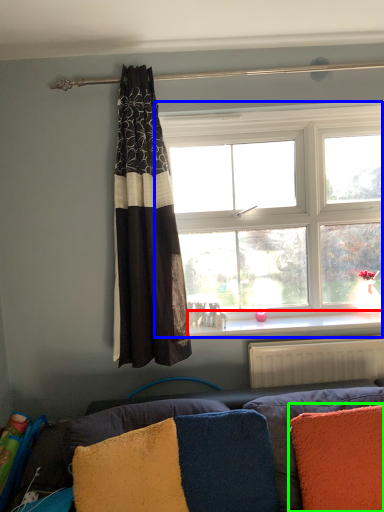
Question: Considering the real-world distances, which object is closest to window sill (highlighted by a red box)? window (highlighted by a blue box) or pillow (highlighted by a green box).

Choices:
 (A) window
 (B) pillow

Answer: (A)